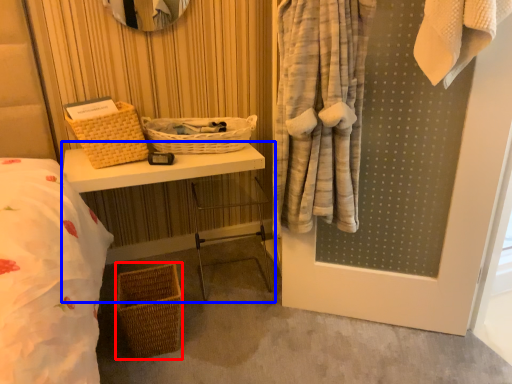
Question: Which point is closer to the camera, basket (highlighted by a red box) or table (highlighted by a blue box)?

Choices:
 (A) basket
 (B) table

Answer: (A)